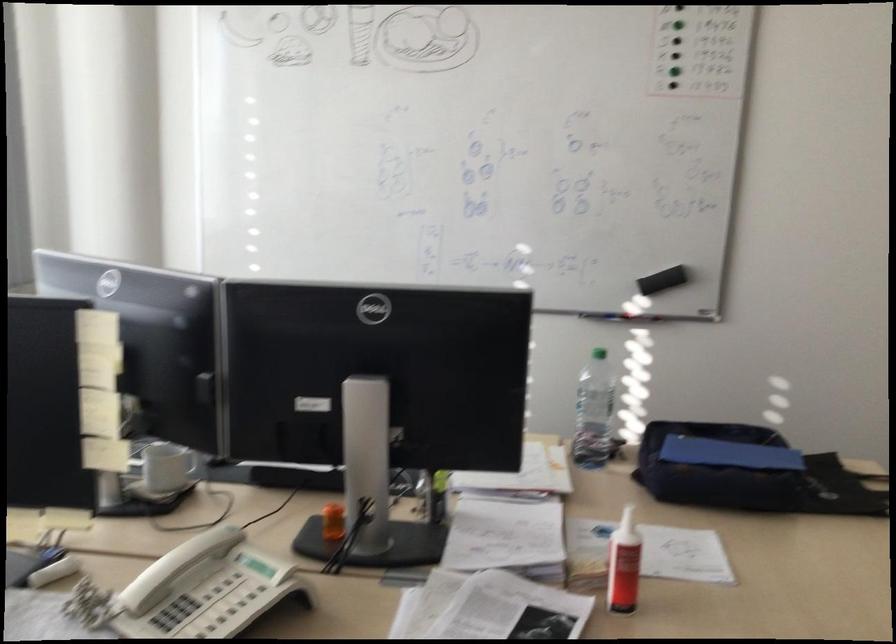
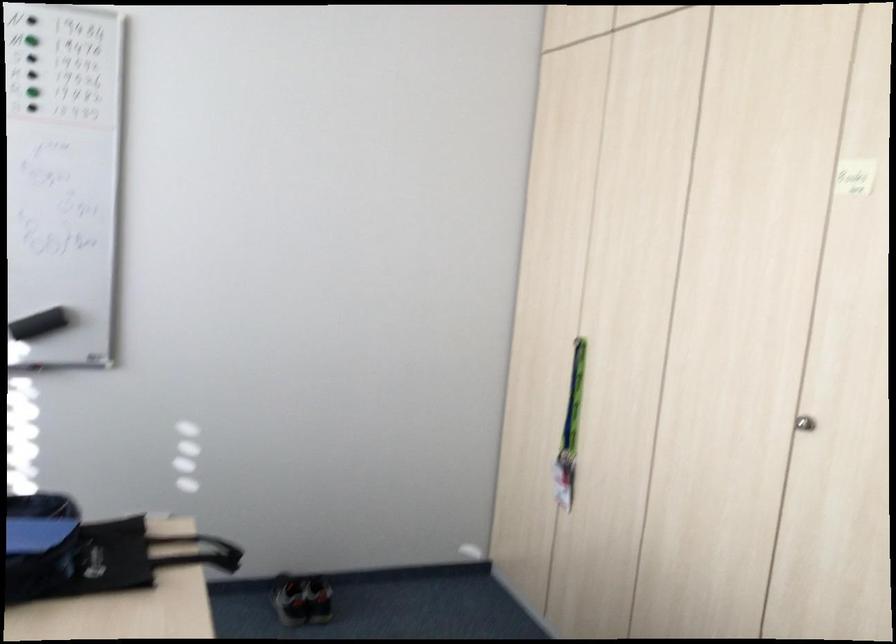
Question: The images are taken continuously from a first-person perspective. In which direction are you moving?

Choices:
 (A) Left
 (B) Right
 (C) Forward
 (D) Backward

Answer: (B)